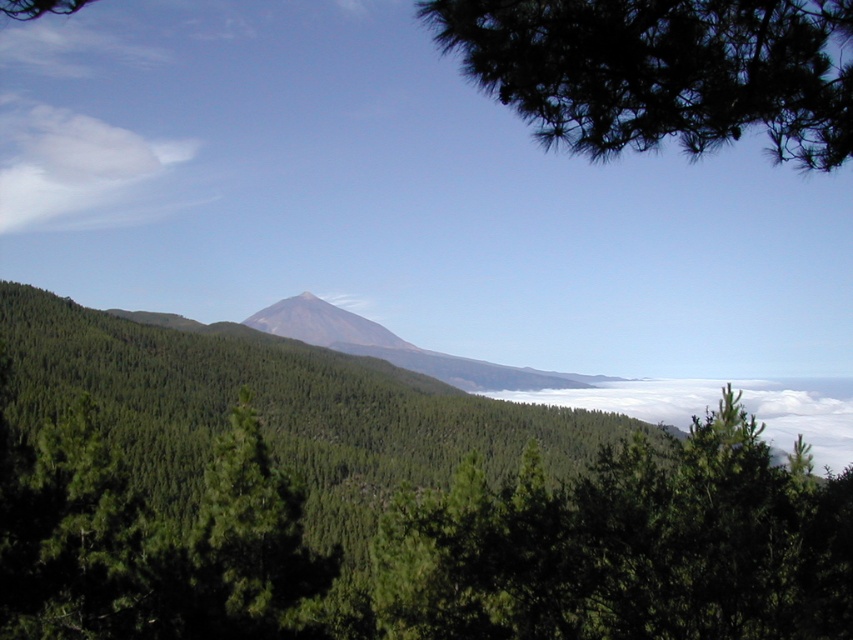
Is point (741, 113) closer to camera compared to point (802, 385)?

Yes, point (741, 113) is in front of point (802, 385).

Between dark green needles at upper right and white fluffy cloud at center, which one has less height?

With less height is dark green needles at upper right.

Which is behind, point (793, 72) or point (704, 380)?

Point (704, 380)

Where is `dark green needles at upper right`? The image size is (853, 640). dark green needles at upper right is located at coordinates (662, 70).

From the picture: Between green leafy tree at center and dark green needles at upper right, which one has more height?

green leafy tree at center is taller.

Is point (576, 534) closer to camera compared to point (717, 138)?

No, (576, 534) is further to viewer.

What are the coordinates of `green leafy tree at center` in the screenshot? It's located at (625, 545).

Does dark green needles at upper right have a lesser height compared to smooth gray mountain at center?

Yes.

Which is above, dark green needles at upper right or smooth gray mountain at center?

dark green needles at upper right

Where is `dark green needles at upper right`? The height and width of the screenshot is (640, 853). dark green needles at upper right is located at coordinates (662, 70).

Locate an element on the screen. This screenshot has height=640, width=853. dark green needles at upper right is located at coordinates (662, 70).